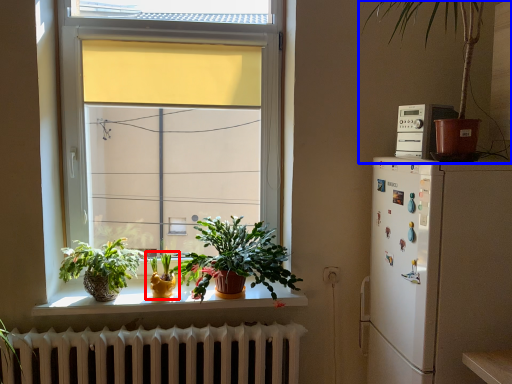
Question: Among these objects, which one is farthest to the camera, houseplant (highlighted by a red box) or houseplant (highlighted by a blue box)?

Choices:
 (A) houseplant
 (B) houseplant

Answer: (A)